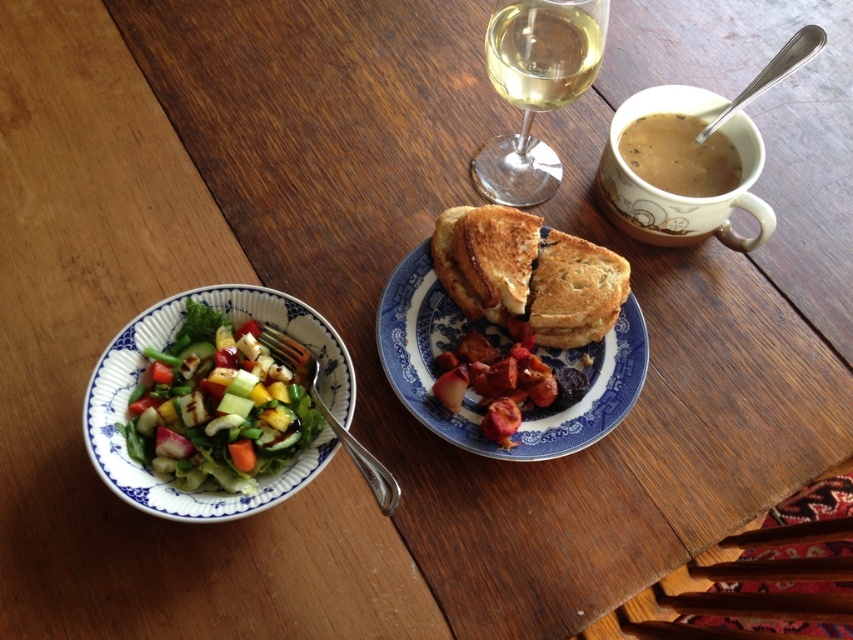
You are setting up a table for a customer and need to place a 4.5 inch wide decorative plate between the brown matte mug at upper right and the brown toasted sandwich at center. Can you fit it there?

The distance between the brown matte mug at upper right and the brown toasted sandwich at center is 3.89 inches, which is less than the 4.5 inch width of the decorative plate. Therefore, the plate cannot be placed between them.

You are standing at the camera position and want to grab the brown matte mug at upper right. Can you reach it without moving your body?

The brown matte mug at upper right is 22.23 inches away from the camera, so if your arm can reach 22.23 inches or more, you can grab it without moving your body.

From the picture: You are a server at a restaurant and need to deliver a plate to a customer. The plate you are holding contains a toasted bread at center and a transparent glass wine glass at upper center. The customer has requested that the distance between these two items on the plate be exactly 5 inches. Based on the image provided, can you confirm if the current arrangement meets the customer requirement?

The toasted bread at center is 5.26 inches away from the transparent glass wine glass at upper center, which is slightly more than the requested 5 inches. Therefore, the current arrangement does not meet the customer requirement.